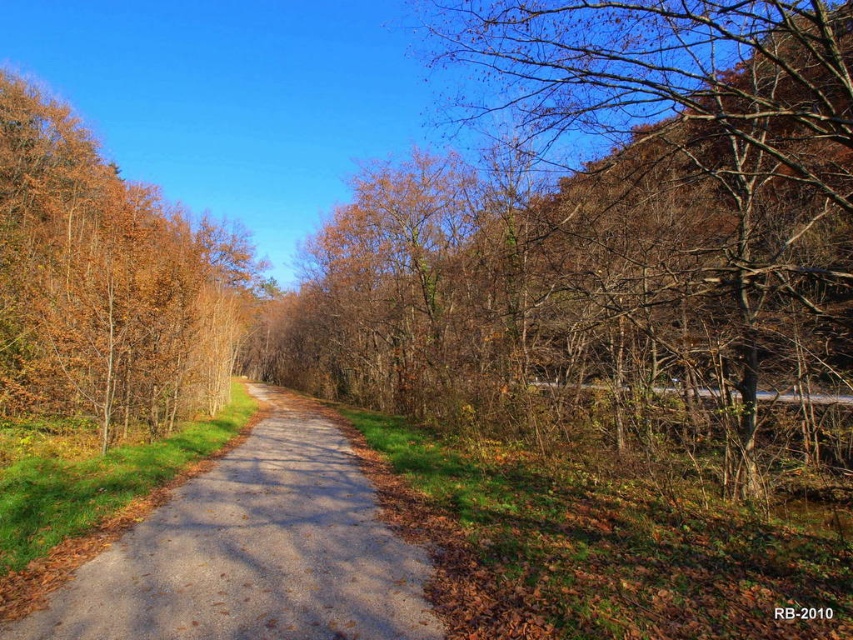
Is point (138, 420) closer to viewer compared to point (311, 634)?

No.

Who is shorter, brown leafy tree at left or gray asphalt trail at center?

gray asphalt trail at center is shorter.

The height and width of the screenshot is (640, 853). What do you see at coordinates (106, 284) in the screenshot? I see `brown leafy tree at left` at bounding box center [106, 284].

Where is `brown leafy tree at left`? brown leafy tree at left is located at coordinates (106, 284).

Consider the image. Can you confirm if brown leafy tree at upper right is wider than gray asphalt trail at center?

In fact, brown leafy tree at upper right might be narrower than gray asphalt trail at center.

Can you confirm if brown leafy tree at upper right is thinner than gray asphalt trail at center?

Yes.

Measure the distance between brown leafy tree at upper right and camera.

brown leafy tree at upper right and camera are 6.88 meters apart.

Identify the location of brown leafy tree at upper right. The height and width of the screenshot is (640, 853). (697, 168).

Can you confirm if brown leafy tree at upper right is wider than brown leafy tree at left?

In fact, brown leafy tree at upper right might be narrower than brown leafy tree at left.

Is point (721, 120) more distant than point (13, 369)?

That is False.

This screenshot has height=640, width=853. What do you see at coordinates (697, 168) in the screenshot?
I see `brown leafy tree at upper right` at bounding box center [697, 168].

This screenshot has height=640, width=853. I want to click on brown leafy tree at upper right, so click(x=697, y=168).